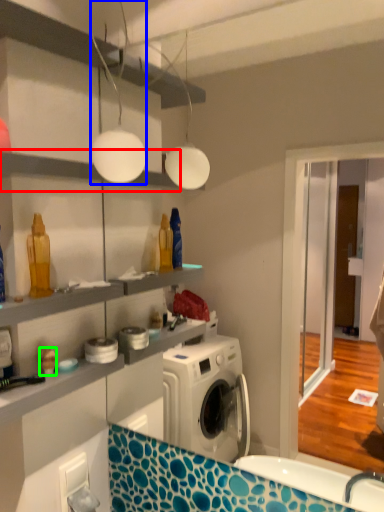
Question: Which is nearer to the shelf (highlighted by a red box)? light fixture (highlighted by a blue box) or toy (highlighted by a green box).

Choices:
 (A) light fixture
 (B) toy

Answer: (A)